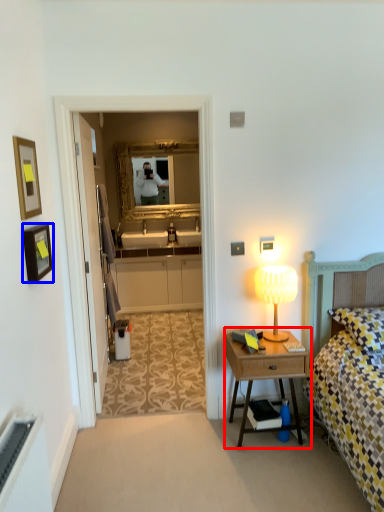
Question: Among these objects, which one is nearest to the camera, nightstand (highlighted by a red box) or picture frame (highlighted by a blue box)?

Choices:
 (A) nightstand
 (B) picture frame

Answer: (B)